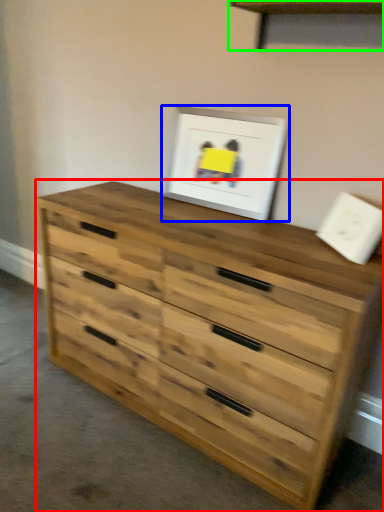
Question: Based on their relative distances, which object is nearer to chest of drawers (highlighted by a red box)? Choose from picture frame (highlighted by a blue box) and shelf (highlighted by a green box).

Choices:
 (A) picture frame
 (B) shelf

Answer: (A)